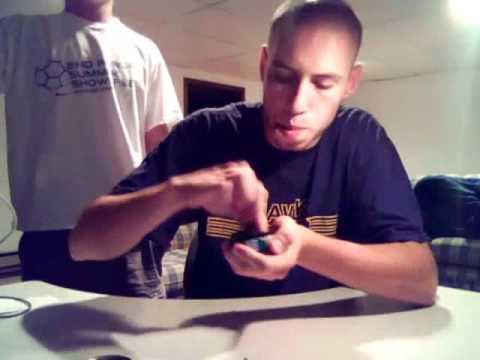
You are a GUI agent. You are given a task and a screenshot of the screen. Output one action in this format:
    pyautogui.click(x=<x>, y=<y>)
    Task: Click on the cream table
    
    Given the screenshot: What is the action you would take?
    pyautogui.click(x=300, y=340)